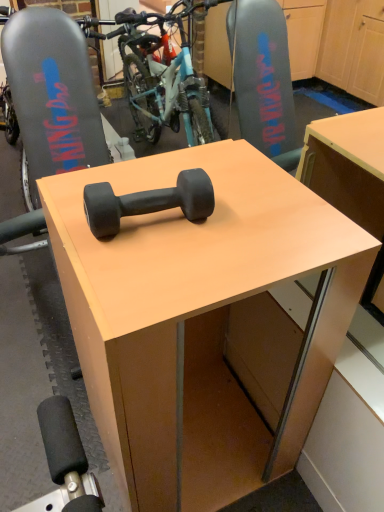
Identify the location of free space in front of black rubber dumbbell at center. The image size is (384, 512). tap(151, 276).